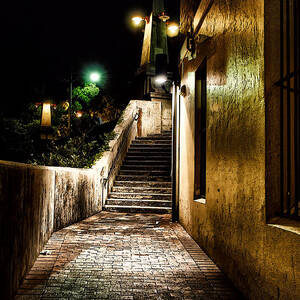
The width and height of the screenshot is (300, 300). I want to click on wall on left, so click(19, 230), click(72, 203), click(97, 186).